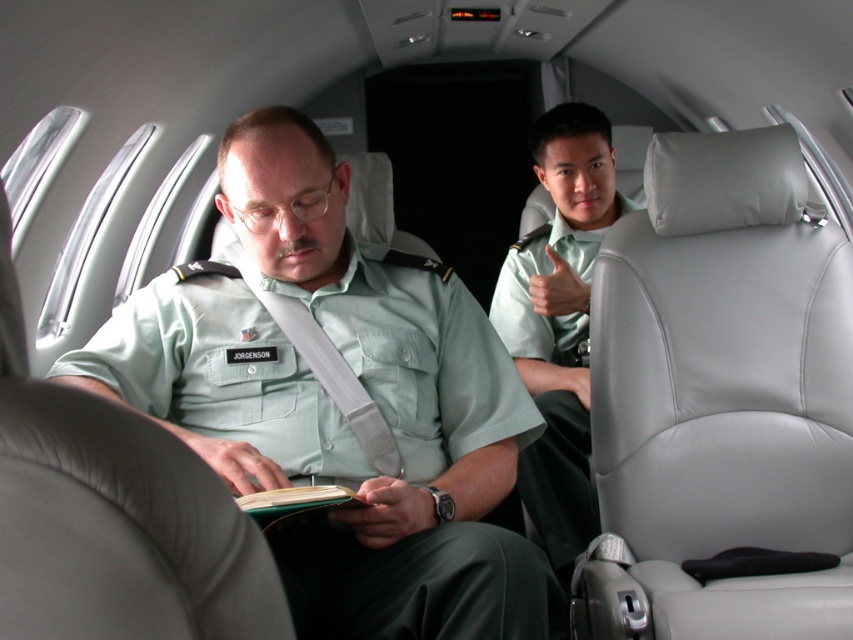
Question: Which object is closer to the camera taking this photo?

Choices:
 (A) green uniform at center
 (B) green matte book at center
 (C) light green fabric shirt at center

Answer: (A)

Question: Is green uniform at center to the left of light green fabric shirt at center from the viewer's perspective?

Choices:
 (A) no
 (B) yes

Answer: (B)

Question: Can you confirm if light green fabric shirt at center is positioned to the left of green matte book at center?

Choices:
 (A) no
 (B) yes

Answer: (A)

Question: Estimate the real-world distances between objects in this image. Which object is farther from the green matte book at center?

Choices:
 (A) green uniform at center
 (B) light green fabric shirt at center

Answer: (B)

Question: Can you confirm if light green fabric shirt at center is positioned below green matte book at center?

Choices:
 (A) yes
 (B) no

Answer: (B)

Question: Which of the following is the closest to the observer?

Choices:
 (A) green matte book at center
 (B) green uniform at center

Answer: (B)